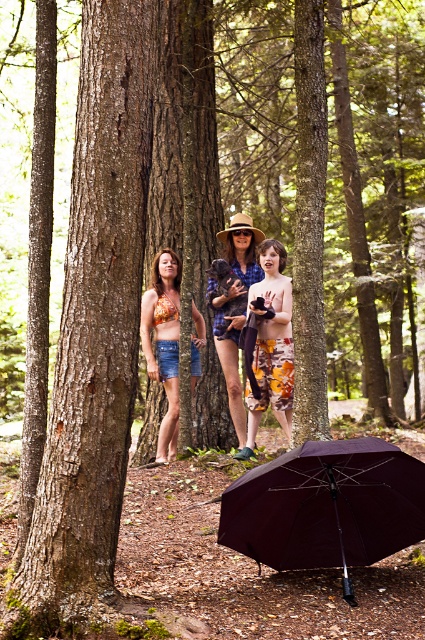
Question: Is floral fabric bikini top at center below matte blue shirt at center?

Choices:
 (A) yes
 (B) no

Answer: (A)

Question: Estimate the real-world distances between objects in this image. Which object is farther from the floral-patterned leggings at center?

Choices:
 (A) matte blue shirt at center
 (B) burgundy fabric umbrella at lower center
 (C) floral fabric bikini top at center

Answer: (B)

Question: Which point appears closest to the camera in this image?

Choices:
 (A) (272, 304)
 (B) (235, 237)
 (C) (178, 328)

Answer: (A)

Question: Is burgundy fabric umbrella at lower center below floral fabric bikini top at center?

Choices:
 (A) no
 (B) yes

Answer: (B)

Question: Does floral-patterned leggings at center appear over matte blue shirt at center?

Choices:
 (A) no
 (B) yes

Answer: (A)

Question: Which of these objects is positioned farthest from the matte blue shirt at center?

Choices:
 (A) floral fabric bikini top at center
 (B) burgundy fabric umbrella at lower center

Answer: (B)